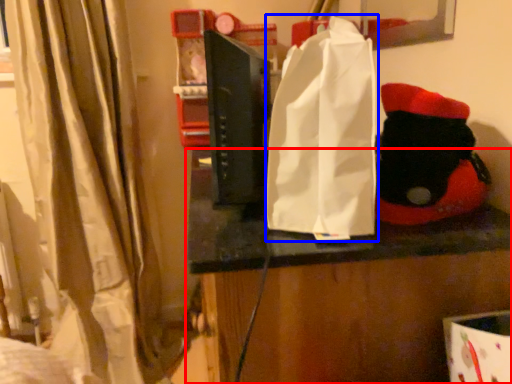
Question: Which object is closer to the camera taking this photo, furniture (highlighted by a red box) or grocery bag (highlighted by a blue box)?

Choices:
 (A) furniture
 (B) grocery bag

Answer: (B)